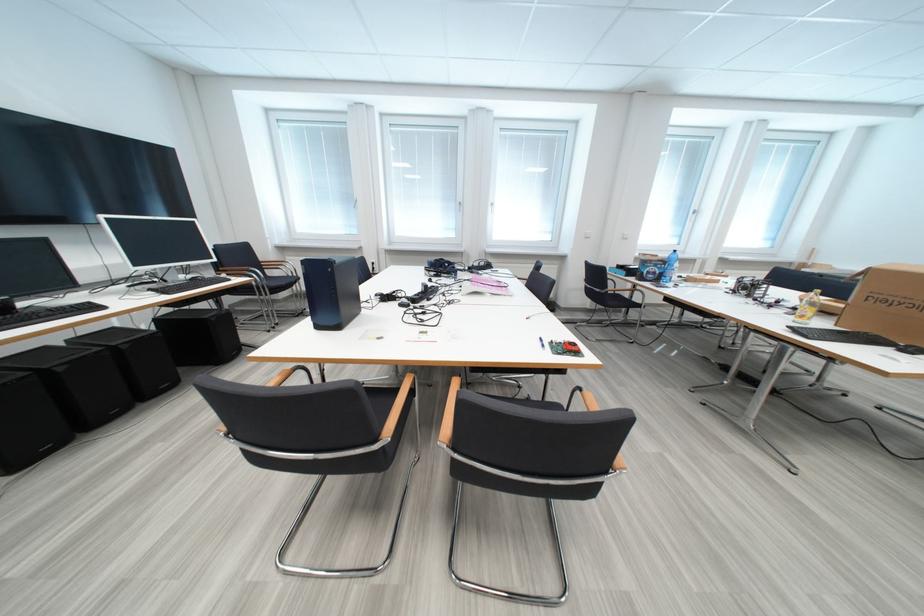
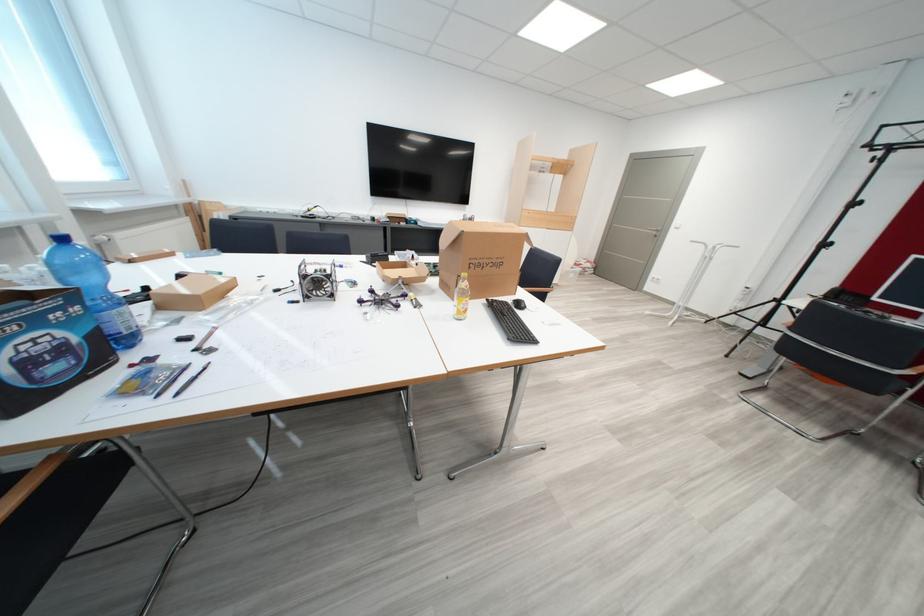
In the second image, find the point that corresponds to (x=745, y=294) in the first image.

(317, 300)